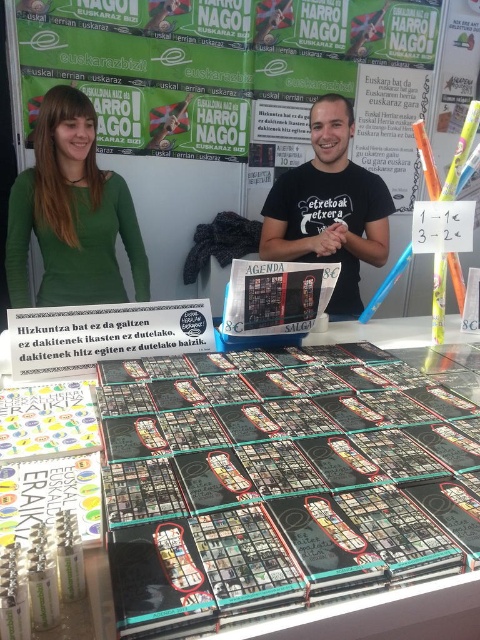
Question: Considering the relative positions of black glossy book at center and green matte shirt at upper left in the image provided, where is black glossy book at center located with respect to green matte shirt at upper left?

Choices:
 (A) below
 (B) above

Answer: (A)

Question: Where is green matte shirt at upper left located in relation to black matte t-shirt at center in the image?

Choices:
 (A) right
 (B) left

Answer: (B)

Question: Which object is positioned farthest from the green matte shirt at upper left?

Choices:
 (A) black matte t-shirt at center
 (B) black glossy book at center

Answer: (B)

Question: Based on their relative distances, which object is nearer to the black glossy book at center?

Choices:
 (A) black matte t-shirt at center
 (B) green matte shirt at upper left

Answer: (A)

Question: Is green matte shirt at upper left thinner than black matte t-shirt at center?

Choices:
 (A) no
 (B) yes

Answer: (B)

Question: Estimate the real-world distances between objects in this image. Which object is farther from the black glossy book at center?

Choices:
 (A) green matte shirt at upper left
 (B) black matte t-shirt at center

Answer: (A)